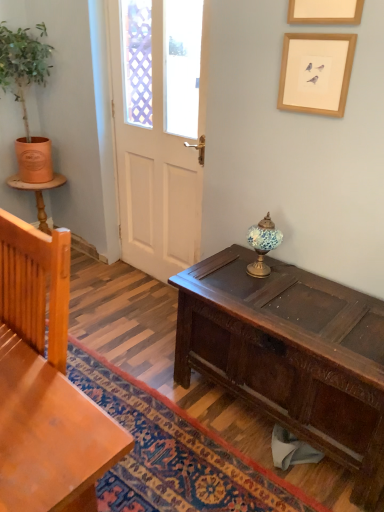
Where is `free location in front of white matte door at center`? This screenshot has height=512, width=384. free location in front of white matte door at center is located at coordinates (144, 306).